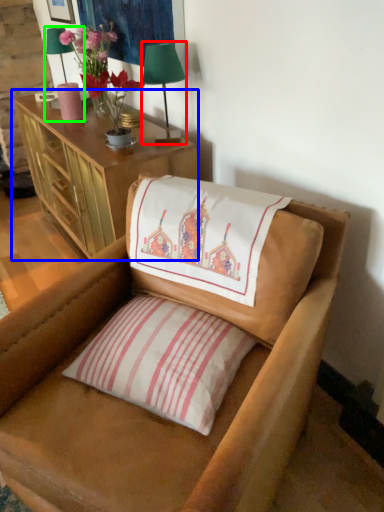
Question: Based on their relative distances, which object is farther from table lamp (highlighted by a red box)? Choose from cabinetry (highlighted by a blue box) and table lamp (highlighted by a green box).

Choices:
 (A) cabinetry
 (B) table lamp

Answer: (A)